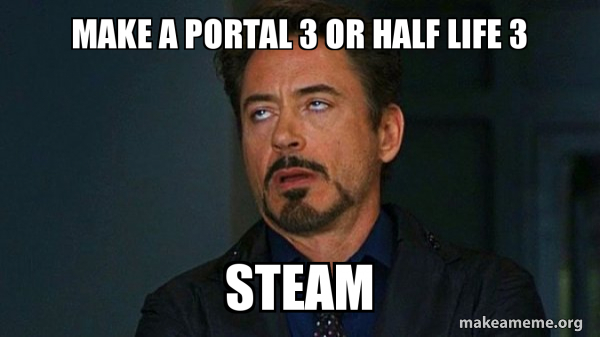
Where is `white wall space in background`? The height and width of the screenshot is (337, 600). white wall space in background is located at coordinates (53, 87), (167, 121), (67, 225), (143, 235).